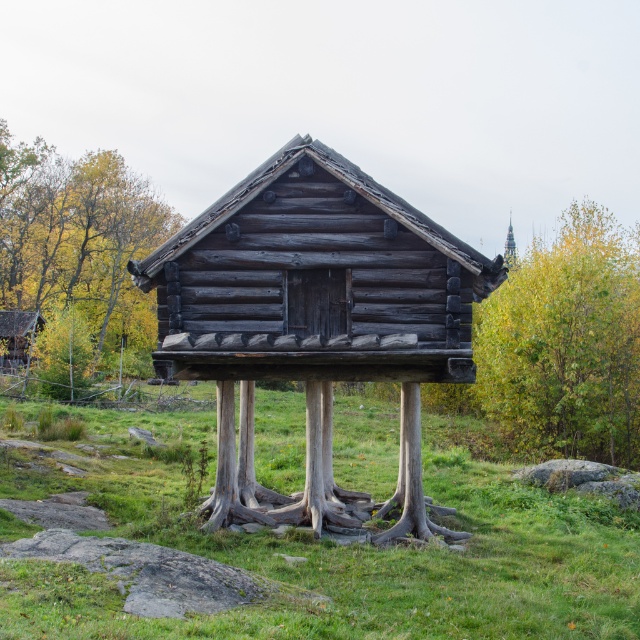
Question: Is weathered wood log cabin at center further to camera compared to brown wood tree at left?

Choices:
 (A) no
 (B) yes

Answer: (A)

Question: In this image, where is brown wood tree at left located relative to wooden cabin at center?

Choices:
 (A) below
 (B) above

Answer: (B)

Question: Which of the following is the closest to the observer?

Choices:
 (A) weathered wood log cabin at center
 (B) brown wood tree at left
 (C) green leafy tree at right
 (D) wooden cabin at center

Answer: (A)

Question: Which object appears closest to the camera in this image?

Choices:
 (A) wooden cabin at center
 (B) green grass at center
 (C) brown wood tree at left
 (D) green leafy tree at right

Answer: (B)

Question: Based on their relative distances, which object is nearer to the brown wood tree at left?

Choices:
 (A) green grass at center
 (B) weathered wood log cabin at center

Answer: (A)

Question: Does green grass at center have a smaller size compared to green leafy tree at right?

Choices:
 (A) no
 (B) yes

Answer: (B)